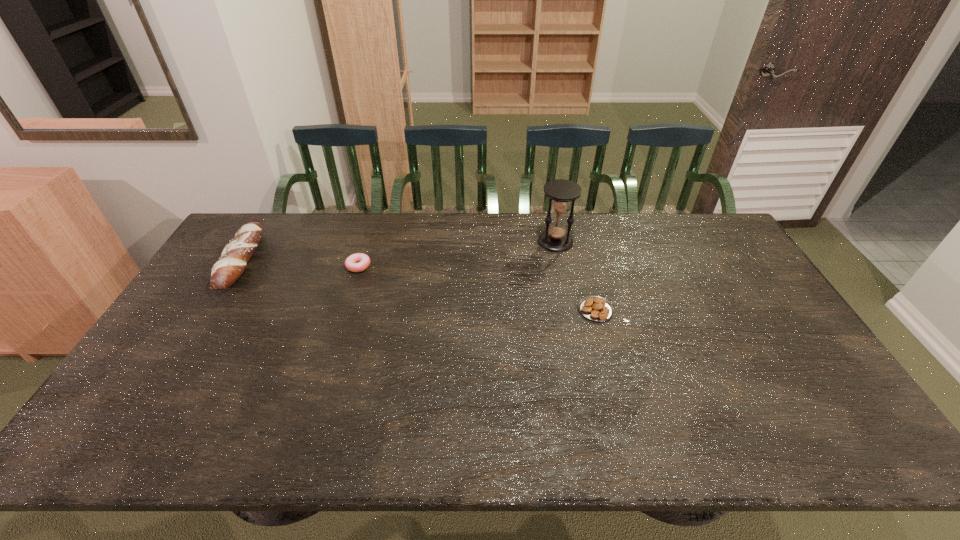
Where is `the tallest object`? Image resolution: width=960 pixels, height=540 pixels. the tallest object is located at coordinates (556, 238).

The height and width of the screenshot is (540, 960). Find the location of `baguet`. baguet is located at coordinates (225, 272).

At what (x,y) coordinates should I click in order to perform the action: click on the leftmost object. Please return your answer as a coordinate pair (x, y). The width and height of the screenshot is (960, 540). Looking at the image, I should click on (225, 272).

Where is `doughnut`? doughnut is located at coordinates (363, 260).

The image size is (960, 540). Find the location of `pastry`. pastry is located at coordinates (595, 308).

You are a GUI agent. You are given a task and a screenshot of the screen. Output one action in this format:
    pyautogui.click(x=<x>, y=<y>)
    Task: Click on the free space located on the right of the hourglass
    Image resolution: width=960 pixels, height=540 pixels.
    Given the screenshot: What is the action you would take?
    pyautogui.click(x=638, y=242)

The height and width of the screenshot is (540, 960). I want to click on vacant area situated 0.080m on the back of the leftmost object, so click(269, 218).

The width and height of the screenshot is (960, 540). Identify the location of free space located 0.120m on the left of the third object from right to left. click(309, 266).

Locate an element on the screen. free space located on the front of the pastry is located at coordinates (616, 388).

Locate an element on the screen. The image size is (960, 540). hourglass that is positioned at the far edge is located at coordinates (556, 238).